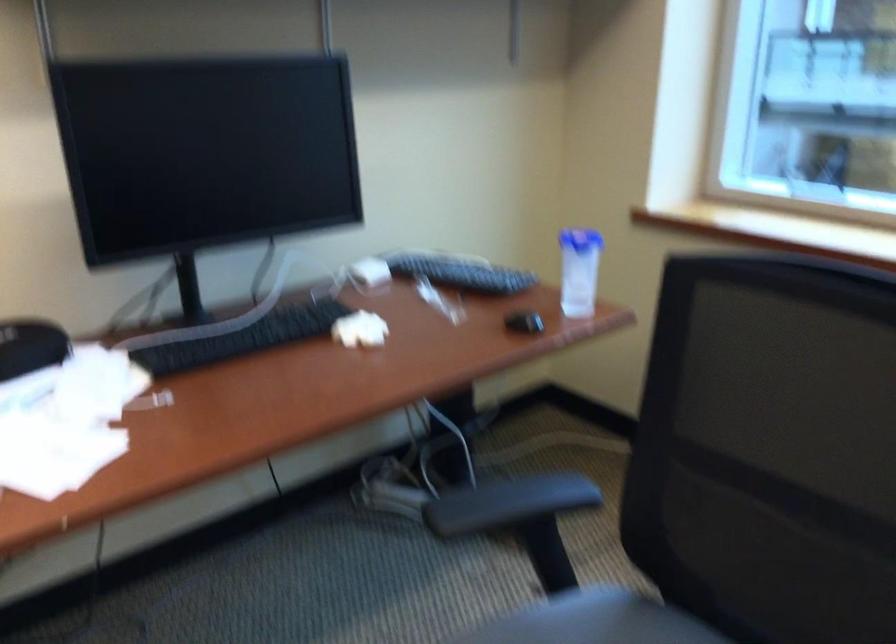
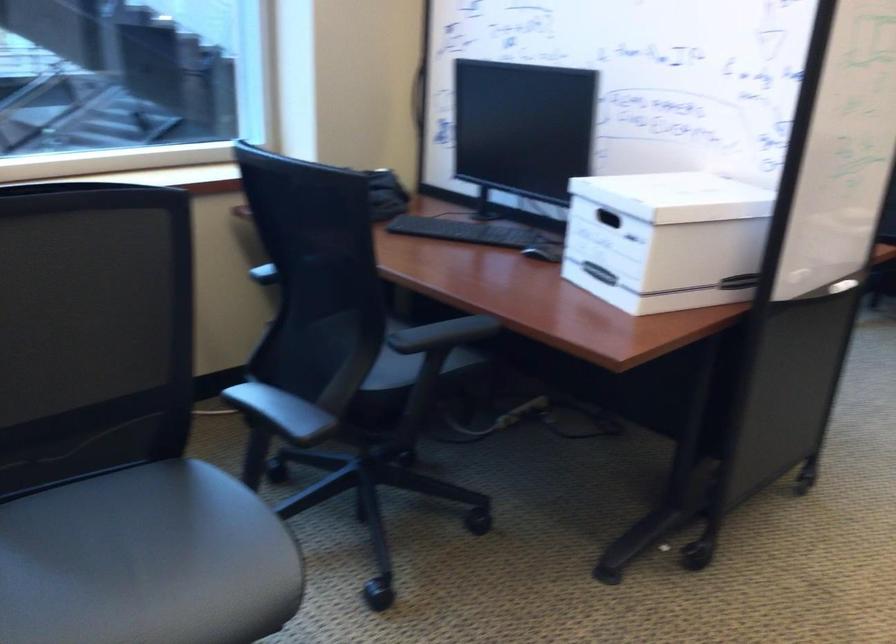
First-person continuous shooting, in which direction is the camera rotating?

The rotation direction of the camera is right-down.